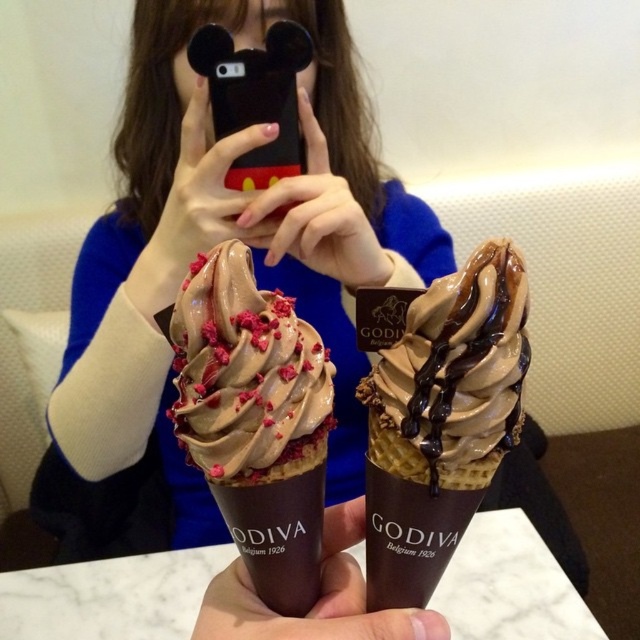
Consider the image. Which is more to the left, chocolatesmoothice cream cone at center or chocolate waffle cone at center?

From the viewer's perspective, chocolatesmoothice cream cone at center appears more on the left side.

Does chocolatesmoothice cream cone at center have a smaller size compared to chocolate waffle cone at center?

No, chocolatesmoothice cream cone at center is not smaller than chocolate waffle cone at center.

Which is behind, point (259, 596) or point (477, 372)?

Point (259, 596)

Where is `chocolatesmoothice cream cone at center`? This screenshot has height=640, width=640. chocolatesmoothice cream cone at center is located at coordinates (253, 419).